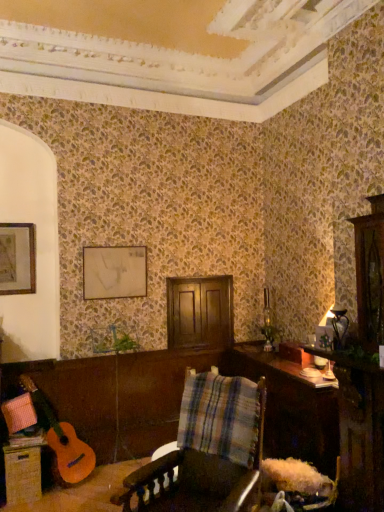
Where is `woven wicker drawer at lower left`? The image size is (384, 512). woven wicker drawer at lower left is located at coordinates (22, 474).

Measure the distance between point (x=40, y=472) and camera.

A: The distance of point (x=40, y=472) from camera is 3.28 meters.

Identify the location of wooden table at lower right. (292, 408).

What do you see at coordinates (17, 258) in the screenshot?
I see `matte gold picture frame at upper left, arranged as the 1th picture frame when viewed from the front` at bounding box center [17, 258].

Find the location of a particular element. This screenshot has height=512, width=384. woven wicker drawer at lower left is located at coordinates tap(22, 474).

In the image, is plaid fabric at center positioned in front of or behind matte white picture frame at upper center, the 2th picture frame in the front-to-back sequence?

Clearly, plaid fabric at center is in front of matte white picture frame at upper center, the 2th picture frame in the front-to-back sequence.

Can you confirm if plaid fabric at center is bigger than matte white picture frame at upper center, the 2th picture frame in the front-to-back sequence?

Yes, plaid fabric at center is bigger than matte white picture frame at upper center, the 2th picture frame in the front-to-back sequence.

From the image's perspective, relative to matte white picture frame at upper center, the 2th picture frame when ordered from left to right, is plaid fabric at center above or below?

Clearly, from the image's perspective, plaid fabric at center is below matte white picture frame at upper center, the 2th picture frame when ordered from left to right.

Looking at this image, is plaid fabric at center thinner than matte white picture frame at upper center, the 1th picture frame from the right?

No, plaid fabric at center is not thinner than matte white picture frame at upper center, the 1th picture frame from the right.

Where is `drawer to the left of wooden plaid chair at center`? The image size is (384, 512). drawer to the left of wooden plaid chair at center is located at coordinates (22, 474).

Which of these two, woven wicker drawer at lower left or wooden plaid chair at center, is thinner?

woven wicker drawer at lower left.

From the image's perspective, between woven wicker drawer at lower left and wooden plaid chair at center, who is located below?

woven wicker drawer at lower left, from the image's perspective.

In terms of size, does woven wicker drawer at lower left appear bigger or smaller than wooden plaid chair at center?

In the image, woven wicker drawer at lower left appears to be smaller than wooden plaid chair at center.

Is matte gold picture frame at upper left, the first picture frame positioned from the left, not close to wooden table at lower right?

matte gold picture frame at upper left, the first picture frame positioned from the left, is positioned a significant distance from wooden table at lower right.

From the image's perspective, is matte gold picture frame at upper left, the first picture frame positioned from the left, on wooden table at lower right?

Yes.

Which is less distant, [26,223] or [238,367]?

Point [26,223]

How different are the orientations of matte gold picture frame at upper left, the first picture frame positioned from the left, and wooden table at lower right in degrees?

The facing directions of matte gold picture frame at upper left, the first picture frame positioned from the left, and wooden table at lower right are 91.2 degrees apart.

How much distance is there between plaid fabric at center and woven wicker drawer at lower left?

plaid fabric at center is 1.54 meters away from woven wicker drawer at lower left.

Is point (243, 418) in front of point (27, 464)?

Yes, point (243, 418) is in front of point (27, 464).

Are plaid fabric at center and woven wicker drawer at lower left located far from each other?

Yes, plaid fabric at center and woven wicker drawer at lower left are located far from each other.

Identify the location of plaid on the right of woven wicker drawer at lower left. The height and width of the screenshot is (512, 384). (220, 417).

Which object is wider, plaid fabric at center or wooden table at lower right?

Wider between the two is wooden table at lower right.

Is plaid fabric at center facing away from wooden table at lower right?

Absolutely, plaid fabric at center is directed away from wooden table at lower right.

Is plaid fabric at center to the left of wooden table at lower right from the viewer's perspective?

Correct, you'll find plaid fabric at center to the left of wooden table at lower right.

Which object is closer to the camera taking this photo, matte white picture frame at upper center, placed as the first picture frame when sorted from back to front, or woven wicker drawer at lower left?

woven wicker drawer at lower left.

Does point (104, 255) appear closer or farther from the camera than point (37, 459)?

Point (104, 255).

Is matte white picture frame at upper center, the 2th picture frame in the front-to-back sequence, oriented away from woven wicker drawer at lower left?

No, matte white picture frame at upper center, the 2th picture frame in the front-to-back sequence,'s orientation is not away from woven wicker drawer at lower left.

Does matte white picture frame at upper center, the 2th picture frame when ordered from left to right, have a lesser height compared to woven wicker drawer at lower left?

No, matte white picture frame at upper center, the 2th picture frame when ordered from left to right, is not shorter than woven wicker drawer at lower left.

Which is more to the right, matte gold picture frame at upper left, arranged as the 1th picture frame when viewed from the front, or matte white picture frame at upper center, the 2th picture frame when ordered from left to right?

matte white picture frame at upper center, the 2th picture frame when ordered from left to right, is more to the right.

Is matte gold picture frame at upper left, the first picture frame positioned from the left, not near matte white picture frame at upper center, placed as the first picture frame when sorted from back to front?

No.

Identify the location of picture frame to the right of matte gold picture frame at upper left, arranged as the 1th picture frame when viewed from the front. tap(114, 272).

Does matte gold picture frame at upper left, arranged as the 1th picture frame when viewed from the front, have a lesser height compared to matte white picture frame at upper center, the 1th picture frame from the right?

No, matte gold picture frame at upper left, arranged as the 1th picture frame when viewed from the front, is not shorter than matte white picture frame at upper center, the 1th picture frame from the right.

Where is `plaid lying in front of the matte white picture frame at upper center, placed as the first picture frame when sorted from back to front`? This screenshot has height=512, width=384. plaid lying in front of the matte white picture frame at upper center, placed as the first picture frame when sorted from back to front is located at coordinates (220, 417).

The width and height of the screenshot is (384, 512). I want to click on drawer on the left of wooden plaid chair at center, so click(22, 474).

Based on their spatial positions, is matte white picture frame at upper center, the 2th picture frame when ordered from left to right, or plaid fabric at center further from wooden plaid chair at center?

The object further to wooden plaid chair at center is matte white picture frame at upper center, the 2th picture frame when ordered from left to right.

When comparing their distances from matte white picture frame at upper center, the 2th picture frame in the front-to-back sequence, does wooden plaid chair at center or wooden table at lower right seem further?

Among the two, wooden plaid chair at center is located further to matte white picture frame at upper center, the 2th picture frame in the front-to-back sequence.

Looking at the image, which one is located closer to plaid fabric at center, matte gold picture frame at upper left, positioned as the 2th picture frame in right-to-left order, or woven wicker drawer at lower left?

Based on the image, woven wicker drawer at lower left appears to be nearer to plaid fabric at center.

Considering their positions, is wooden table at lower right positioned further to woven wicker drawer at lower left than plaid fabric at center?

Among the two, wooden table at lower right is located further to woven wicker drawer at lower left.

Estimate the real-world distances between objects in this image. Which object is further from plaid fabric at center, matte gold picture frame at upper left, arranged as the 1th picture frame when viewed from the front, or wooden plaid chair at center?

Among the two, matte gold picture frame at upper left, arranged as the 1th picture frame when viewed from the front, is located further to plaid fabric at center.

From the image, which object appears to be farther from wooden table at lower right, wooden plaid chair at center or matte white picture frame at upper center, placed as the first picture frame when sorted from back to front?

matte white picture frame at upper center, placed as the first picture frame when sorted from back to front, is further to wooden table at lower right.

Estimate the real-world distances between objects in this image. Which object is closer to matte gold picture frame at upper left, positioned as the 2th picture frame in right-to-left order, wooden table at lower right or wooden plaid chair at center?

wooden plaid chair at center.

Estimate the real-world distances between objects in this image. Which object is further from woven wicker drawer at lower left, wooden plaid chair at center or matte gold picture frame at upper left, positioned as the 2th picture frame in right-to-left order?

matte gold picture frame at upper left, positioned as the 2th picture frame in right-to-left order, lies further to woven wicker drawer at lower left than the other object.

At what (x,y) coordinates should I click in order to perform the action: click on plaid between wooden plaid chair at center and wooden table at lower right in the front-back direction. Please return your answer as a coordinate pair (x, y). Looking at the image, I should click on (220, 417).

Where is `picture frame positioned between wooden plaid chair at center and matte white picture frame at upper center, the 2th picture frame when ordered from left to right, from near to far`? picture frame positioned between wooden plaid chair at center and matte white picture frame at upper center, the 2th picture frame when ordered from left to right, from near to far is located at coordinates (17, 258).

Where is `plaid between matte white picture frame at upper center, the 2th picture frame when ordered from left to right, and wooden table at lower right, in the horizontal direction`? plaid between matte white picture frame at upper center, the 2th picture frame when ordered from left to right, and wooden table at lower right, in the horizontal direction is located at coordinates (220, 417).

What are the coordinates of `drawer between matte gold picture frame at upper left, arranged as the 1th picture frame when viewed from the front, and wooden table at lower right` in the screenshot? It's located at (22, 474).